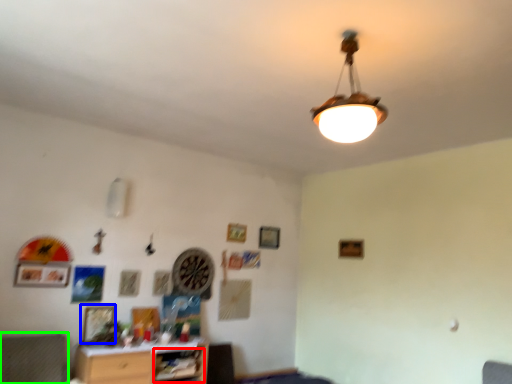
Question: Which object is the closest to the shelf (highlighted by a red box)? Choose among these: picture frame (highlighted by a blue box) or swivel chair (highlighted by a green box).

Choices:
 (A) picture frame
 (B) swivel chair

Answer: (A)